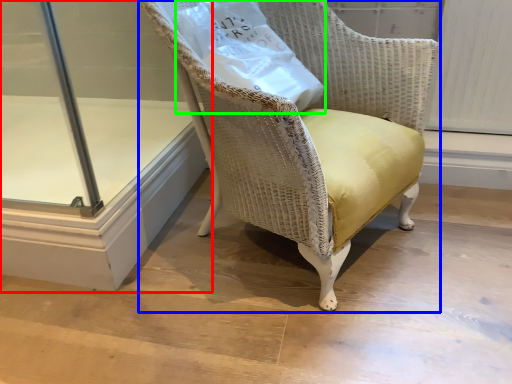
Question: Which object is positioned closest to glass door (highlighted by a red box)? Select from chair (highlighted by a blue box) and paper bag (highlighted by a green box).

Choices:
 (A) chair
 (B) paper bag

Answer: (A)